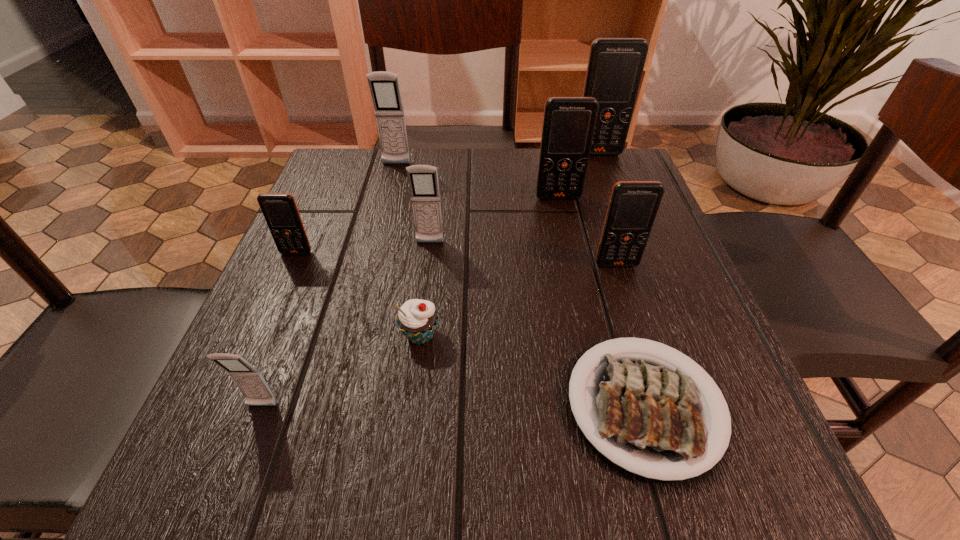
The height and width of the screenshot is (540, 960). Find the location of `the leftmost orange cellular telephone`. the leftmost orange cellular telephone is located at coordinates (280, 211).

At what (x,y) coordinates should I click in order to perform the action: click on the fifth nearest object. Please return your answer as a coordinate pair (x, y). The width and height of the screenshot is (960, 540). Looking at the image, I should click on (280, 211).

You are a GUI agent. You are given a task and a screenshot of the screen. Output one action in this format:
    pyautogui.click(x=<x>, y=<y>)
    Task: Click on the smallest gray cellular telephone
    
    Given the screenshot: What is the action you would take?
    pyautogui.click(x=249, y=380)

At what (x,y) coordinates should I click in order to perform the action: click on the nearest cellular telephone. Please return your answer as a coordinate pair (x, y). The image size is (960, 540). Looking at the image, I should click on [x=249, y=380].

This screenshot has width=960, height=540. I want to click on the eighth tallest object, so click(417, 319).

The image size is (960, 540). Find the location of `the shortest object`. the shortest object is located at coordinates (651, 416).

Identify the location of vacant region located 0.260m on the screen of the biggest orange cellular telephone. The image size is (960, 540). (623, 221).

Where is `free space located on the front-facing side of the farthest gray cellular telephone`? Image resolution: width=960 pixels, height=540 pixels. free space located on the front-facing side of the farthest gray cellular telephone is located at coordinates (388, 199).

At what (x,y) coordinates should I click in order to perform the action: click on vacant region located on the screen of the second farthest orange cellular telephone. Please return your answer as a coordinate pair (x, y). Looking at the image, I should click on (575, 275).

This screenshot has width=960, height=540. I want to click on free space located on the front-facing side of the rightmost gray cellular telephone, so click(x=409, y=413).